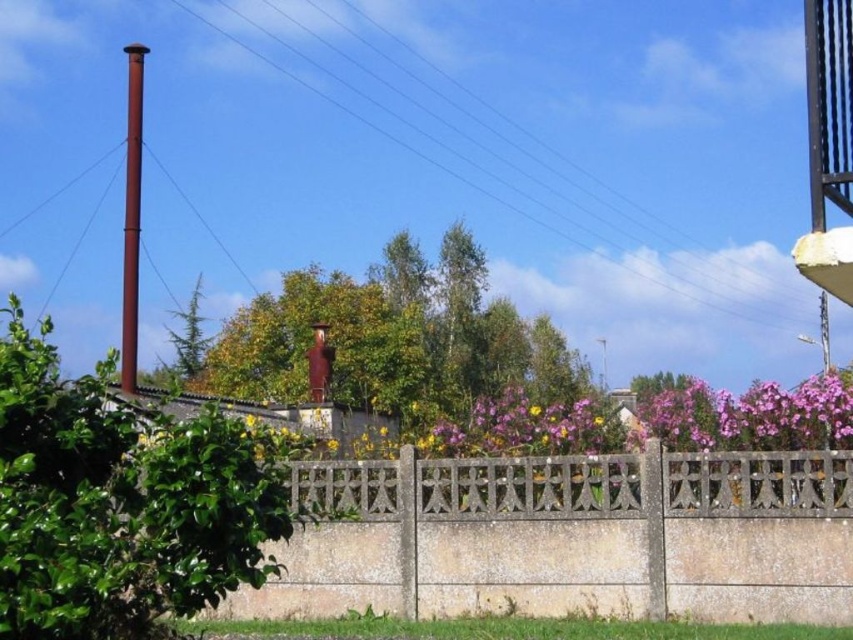
Does metallic wire at upper center appear under rusty metal pole at left?

Incorrect, metallic wire at upper center is not positioned below rusty metal pole at left.

Is metallic wire at upper center to the right of rusty metal pole at left from the viewer's perspective?

Indeed, metallic wire at upper center is positioned on the right side of rusty metal pole at left.

Find the location of `metallic wire at upper center`. metallic wire at upper center is located at coordinates (477, 182).

Measure the distance between concrete textured fence at center and metallic wire at upper center.

They are 69.59 meters apart.

Find the location of a particular element. concrete textured fence at center is located at coordinates (567, 538).

Between point (585, 502) and point (233, 38), which one is positioned in front?

Positioned in front is point (585, 502).

The height and width of the screenshot is (640, 853). I want to click on concrete textured fence at center, so click(x=567, y=538).

Does concrete textured fence at center lie in front of rusty metal pole at left?

Yes.

Does point (515, 500) come behind point (126, 132)?

No, it is not.

In order to click on concrete textured fence at center in this screenshot , I will do `click(567, 538)`.